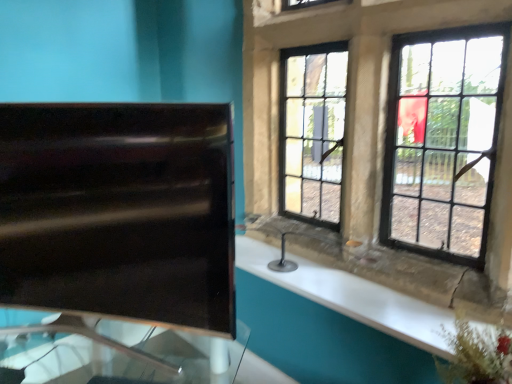
Question: Based on their sizes in the image, would you say black glossy sink at left is bigger or smaller than white glossy counter top at right?

Choices:
 (A) big
 (B) small

Answer: (A)

Question: Is point (31, 218) closer or farther from the camera than point (389, 322)?

Choices:
 (A) closer
 (B) farther

Answer: (A)

Question: Estimate the real-world distances between objects in this image. Which object is closer to the transparent glass table at left?

Choices:
 (A) black glass window at upper right
 (B) black glossy sink at left
 (C) white glossy counter top at right

Answer: (B)

Question: Which object is the farthest from the transparent glass table at left?

Choices:
 (A) black glass window at upper right
 (B) white glossy counter top at right
 (C) black glossy sink at left

Answer: (A)